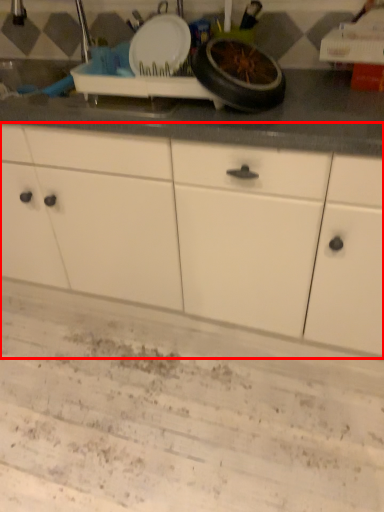
Question: From the image's perspective, what is the correct spatial relationship of cabinetry (annotated by the red box) in relation to wheel?

Choices:
 (A) below
 (B) above

Answer: (A)